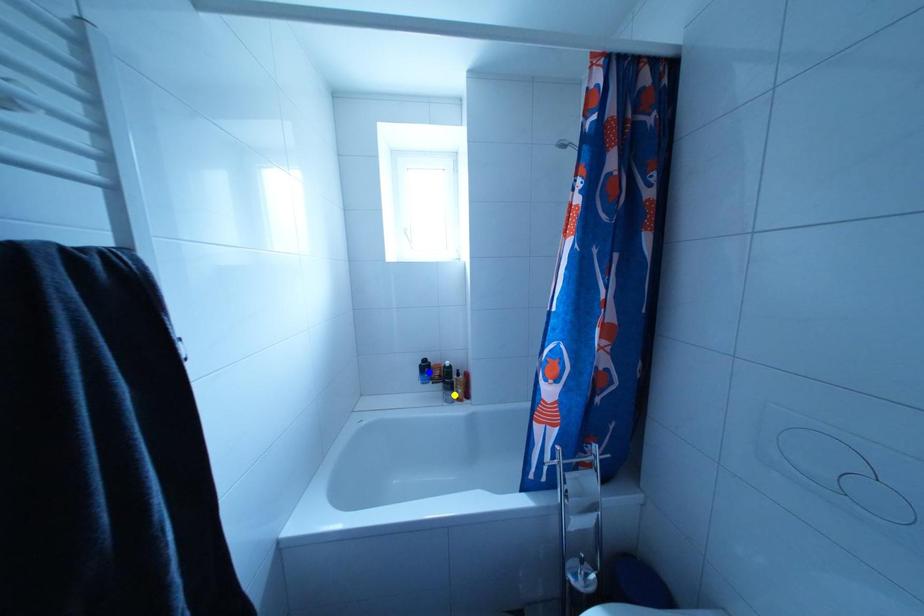
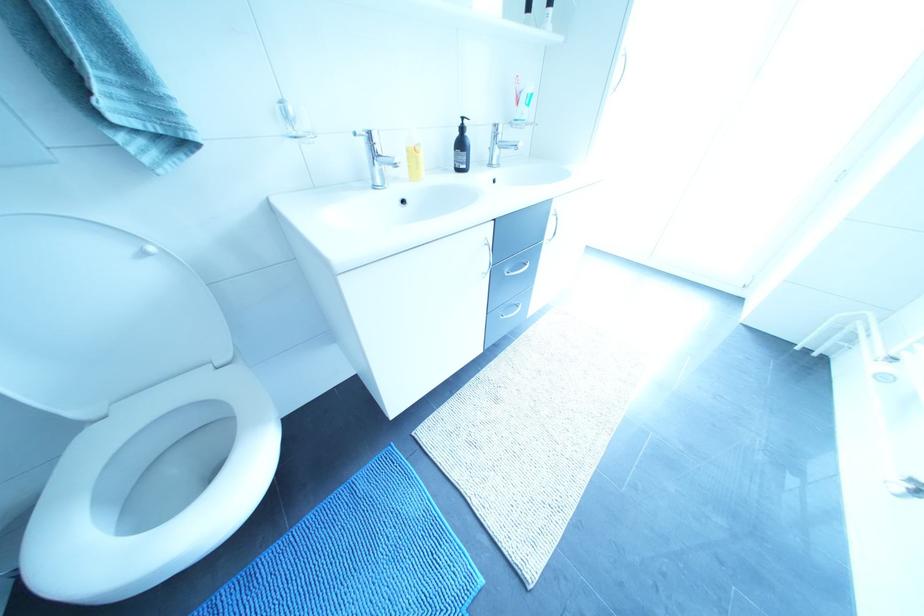
I am providing you with two images of the same scene from different viewpoints. Three points are marked in image1. Which point corresponds to a part or object that is occluded in image2?In image1, three points are marked. Which of them correspond to a part or object that is occluded in image2?Among the three points shown in image1, which one corresponds to a part or object that is no longer visible due to occlusion in image2?

green point, blue point, yellow point cannot be seen in image2.